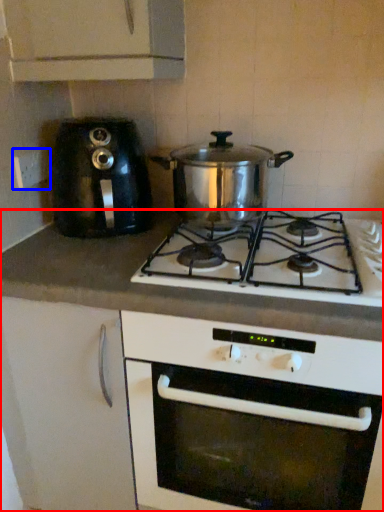
Question: Which object appears farthest to the camera in this image, counter (highlighted by a red box) or electric outlet (highlighted by a blue box)?

Choices:
 (A) counter
 (B) electric outlet

Answer: (B)